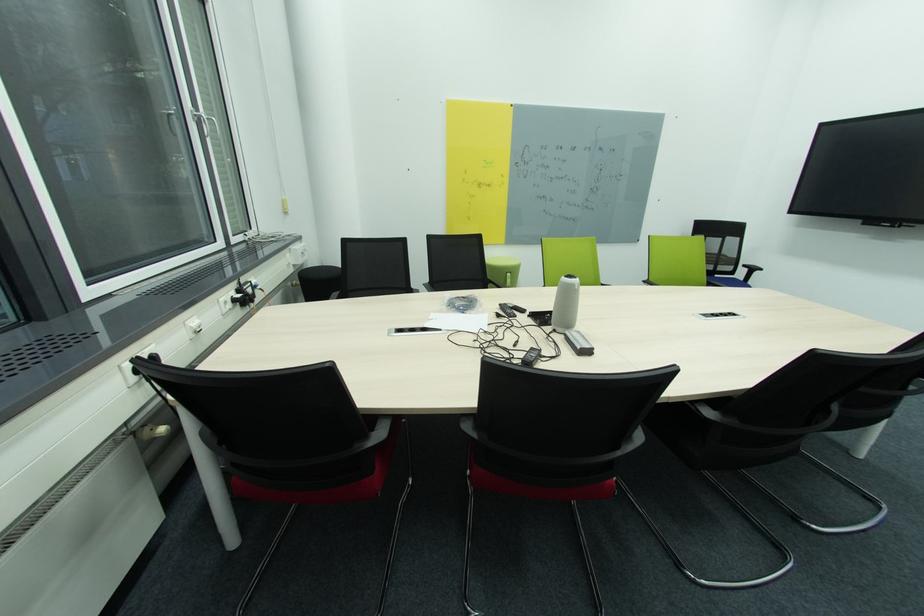
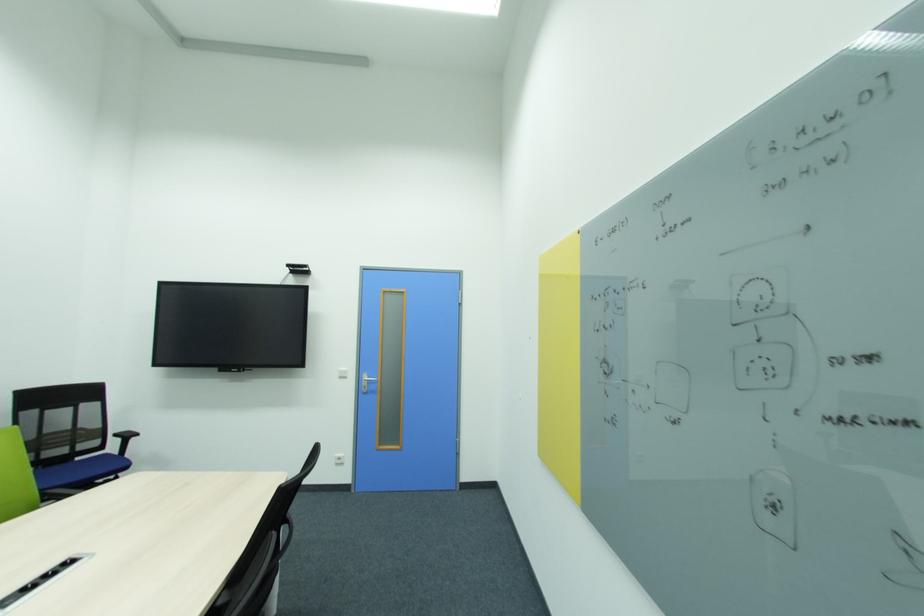
Locate, in the second image, the point that corresponds to (721,277) in the first image.

(82, 460)